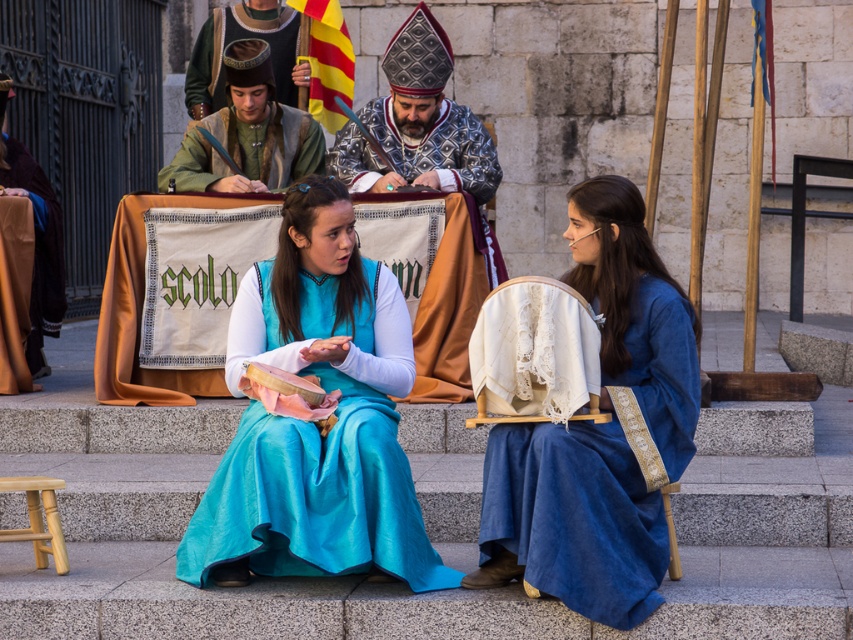
Looking at this image, is blue velvet dress at center taller than green woolen tunic at upper center?

Indeed, blue velvet dress at center has a greater height compared to green woolen tunic at upper center.

Can you confirm if blue velvet dress at center is positioned to the left of green woolen tunic at upper center?

No, blue velvet dress at center is not to the left of green woolen tunic at upper center.

Which is behind, point (668, 364) or point (241, 22)?

Positioned behind is point (241, 22).

Where is `blue velvet dress at center`? This screenshot has height=640, width=853. blue velvet dress at center is located at coordinates (601, 433).

Is matte blue dress at center taller than silver metallic bishop's hat at upper center?

Indeed, matte blue dress at center has a greater height compared to silver metallic bishop's hat at upper center.

Who is positioned more to the left, matte blue dress at center or silver metallic bishop's hat at upper center?

matte blue dress at center is more to the left.

Find the location of a particular element. The height and width of the screenshot is (640, 853). matte blue dress at center is located at coordinates (312, 426).

Can you confirm if blue velvet dress at center is bigger than green woolen tunic at center?

Correct, blue velvet dress at center is larger in size than green woolen tunic at center.

Is blue velvet dress at center taller than green woolen tunic at center?

Correct, blue velvet dress at center is much taller as green woolen tunic at center.

Between point (532, 556) and point (241, 44), which one is positioned in front?

Positioned in front is point (532, 556).

Locate an element on the screen. Image resolution: width=853 pixels, height=640 pixels. blue velvet dress at center is located at coordinates (601, 433).